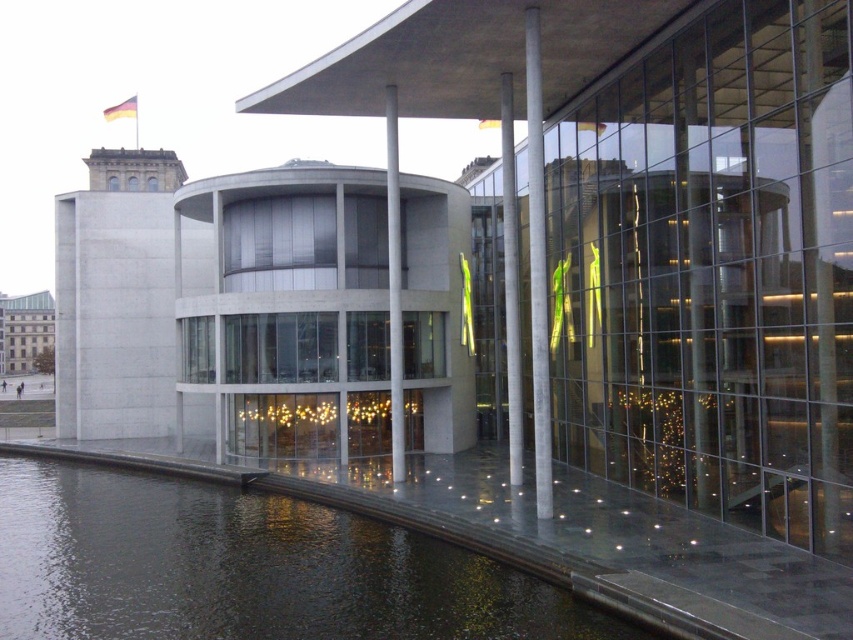
Looking at this image, does concrete pillar at center have a smaller size compared to sleek metallic pole at center?

No, concrete pillar at center is not smaller than sleek metallic pole at center.

Can you confirm if concrete pillar at center is positioned to the left of sleek metallic pole at center?

In fact, concrete pillar at center is to the right of sleek metallic pole at center.

You are a GUI agent. You are given a task and a screenshot of the screen. Output one action in this format:
    pyautogui.click(x=<x>, y=<y>)
    Task: Click on the concrete pillar at center
    This screenshot has width=853, height=640.
    Given the screenshot: What is the action you would take?
    pyautogui.click(x=537, y=268)

Where is `concrete pillar at center`? The height and width of the screenshot is (640, 853). concrete pillar at center is located at coordinates (537, 268).

The width and height of the screenshot is (853, 640). Identify the location of transparent glass waterway at lower left. (247, 568).

What do you see at coordinates (247, 568) in the screenshot? The width and height of the screenshot is (853, 640). I see `transparent glass waterway at lower left` at bounding box center [247, 568].

Image resolution: width=853 pixels, height=640 pixels. In order to click on transparent glass waterway at lower left in this screenshot , I will do `click(247, 568)`.

What do you see at coordinates (537, 268) in the screenshot? I see `concrete pillar at center` at bounding box center [537, 268].

Can you confirm if concrete pillar at center is thinner than white concrete pillar at center?

Correct, concrete pillar at center's width is less than white concrete pillar at center's.

Which is behind, point (534, 129) or point (397, 324)?

Point (397, 324)

You are a GUI agent. You are given a task and a screenshot of the screen. Output one action in this format:
    pyautogui.click(x=<x>, y=<y>)
    Task: Click on the concrete pillar at center
    
    Given the screenshot: What is the action you would take?
    pyautogui.click(x=537, y=268)